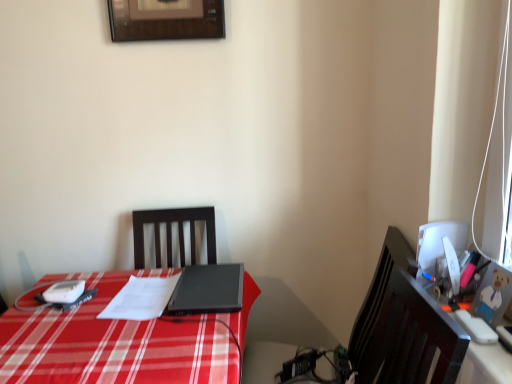
Question: From a real-world perspective, is black matte laptop at center beneath orange plastic toy at right?

Choices:
 (A) no
 (B) yes

Answer: (B)

Question: From the image's perspective, does black matte laptop at center appear higher than orange plastic toy at right?

Choices:
 (A) no
 (B) yes

Answer: (B)

Question: Is black matte laptop at center closer to camera compared to orange plastic toy at right?

Choices:
 (A) yes
 (B) no

Answer: (B)

Question: Is black matte laptop at center smaller than orange plastic toy at right?

Choices:
 (A) yes
 (B) no

Answer: (B)

Question: Is black matte laptop at center further to camera compared to orange plastic toy at right?

Choices:
 (A) yes
 (B) no

Answer: (A)

Question: Is black matte laptop at center at the right side of orange plastic toy at right?

Choices:
 (A) no
 (B) yes

Answer: (A)

Question: Considering the relative sizes of white paper at center and orange plastic toy at right in the image provided, is white paper at center bigger than orange plastic toy at right?

Choices:
 (A) yes
 (B) no

Answer: (A)

Question: From a real-world perspective, does white paper at center stand above orange plastic toy at right?

Choices:
 (A) no
 (B) yes

Answer: (A)

Question: Considering the relative sizes of white paper at center and orange plastic toy at right in the image provided, is white paper at center taller than orange plastic toy at right?

Choices:
 (A) no
 (B) yes

Answer: (B)

Question: From a real-world perspective, is white paper at center positioned under orange plastic toy at right based on gravity?

Choices:
 (A) no
 (B) yes

Answer: (B)

Question: From the image's perspective, is white paper at center below orange plastic toy at right?

Choices:
 (A) yes
 (B) no

Answer: (A)

Question: Are white paper at center and orange plastic toy at right beside each other?

Choices:
 (A) no
 (B) yes

Answer: (A)

Question: Would you say orange plastic toy at right is outside black matte laptop at center?

Choices:
 (A) no
 (B) yes

Answer: (B)